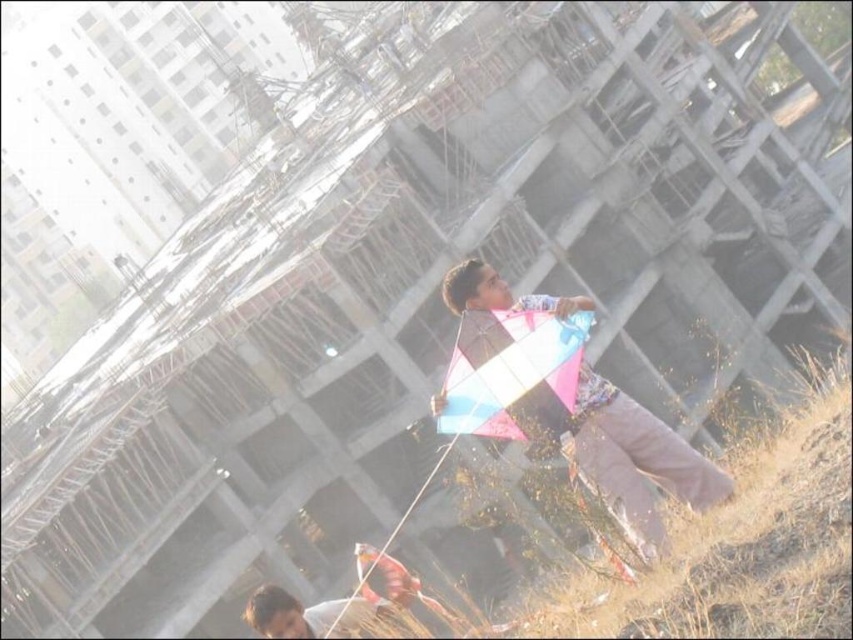
You are a drone operator trying to capture a photo of the child and the matte pink kite at center. The drone is currently at point (625, 454). Is the drone positioned above the matte pink kite at center?

Yes, the point (625, 454) is on the matte pink kite at center, so the drone is positioned above the matte pink kite at center.

You are a photographer trying to capture both the matte pink kite at center and the translucent plastic kite at center in the same frame. Which kite should you adjust your camera to focus on first if you want to ensure both are in the shot?

You should focus on the translucent plastic kite at center first since the matte pink kite at center is to the right of it, allowing you to frame both by adjusting from left to right.